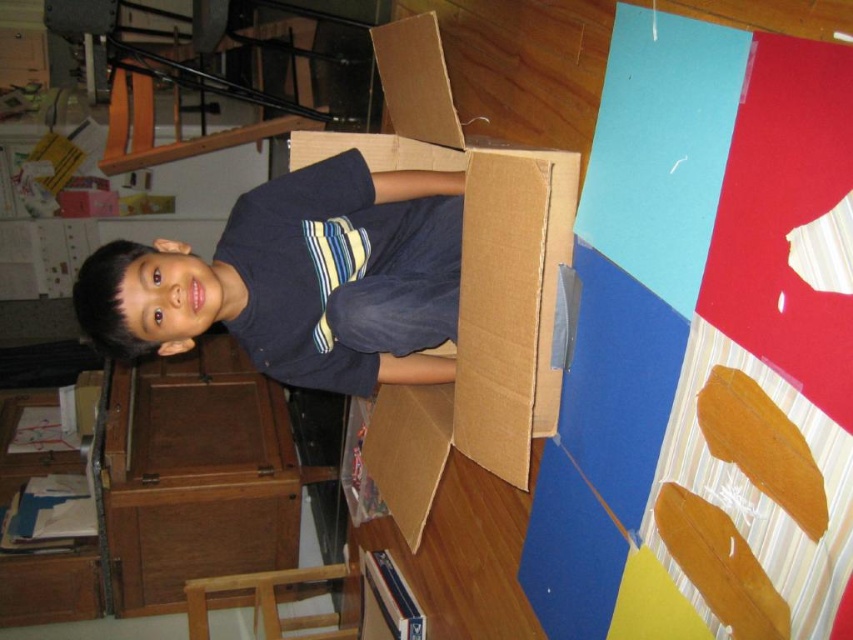
You are a parent trying to decide if your child can fit a new toy into the cardboard box at center while wearing their dark blue shirt at center. Based on their sizes, can the toy fit inside the box?

The dark blue shirt at center is wider than the cardboard box at center, which means the shirt itself is larger than the box. Therefore, if the toy is similar in size to the shirt, it would not fit inside the box. However, if the toy is smaller than the box, it might fit. Since the question doesn not specify the toy size, we can only conclude that the box is smaller than the shirt, so larger items like the shirt wouldn fit, but smaller toys could potentially fit depending on their size.

You are a photographer trying to capture a photo of the dark blue shirt at center and the cardboard box at center. From the camera position, which object is more to the left?

The dark blue shirt at center is positioned on the left side of cardboard box at center, so the dark blue shirt at center is more to the left.

You are a parent trying to decide if your child can comfortably sit inside the cardboard box at center while wearing their dark blue shirt at center. Based on their sizes, can the child fit inside the box?

The dark blue shirt at center is smaller than the cardboard box at center, so the child wearing the dark blue shirt at center should be able to comfortably fit inside the cardboard box at center.